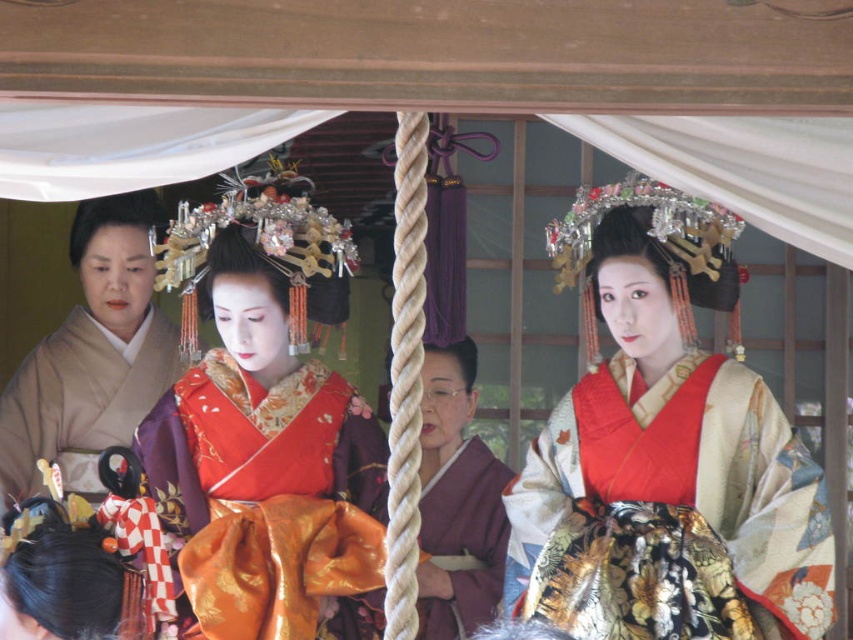
You are standing in the room where the geisha and maiko are performing. You notice two points marked on the floor at coordinates point [755,406] and point [27,380]. If you were to walk from the first point to the second, would you be moving towards the entrance of the room or away from it?

The point [755,406] is in front of point [27,380], so walking from the first to the second point would mean moving away from the entrance since the second point is behind the first relative to the entrance direction.

You are a tailor who needs to determine which kimono requires more fabric based on their widths. Which kimono requires more fabric between the silky orange kimono at center and the silky purple kimono at left?

The silky orange kimono at center requires more fabric because its width surpasses that of the silky purple kimono at left.

You are a photographer planning to take a portrait of the two kimonos in the scene. You want to arrange them so that the silky silk kimono at center is on the left side of the silky purple kimono at left. Is this arrangement possible based on their current positions?

The silky silk kimono at center is currently positioned on the right side of the silky purple kimono at left. To arrange them so that the silky silk kimono at center is on the left side of the silky purple kimono at left, you would need to swap their positions since they are currently in the opposite arrangement.